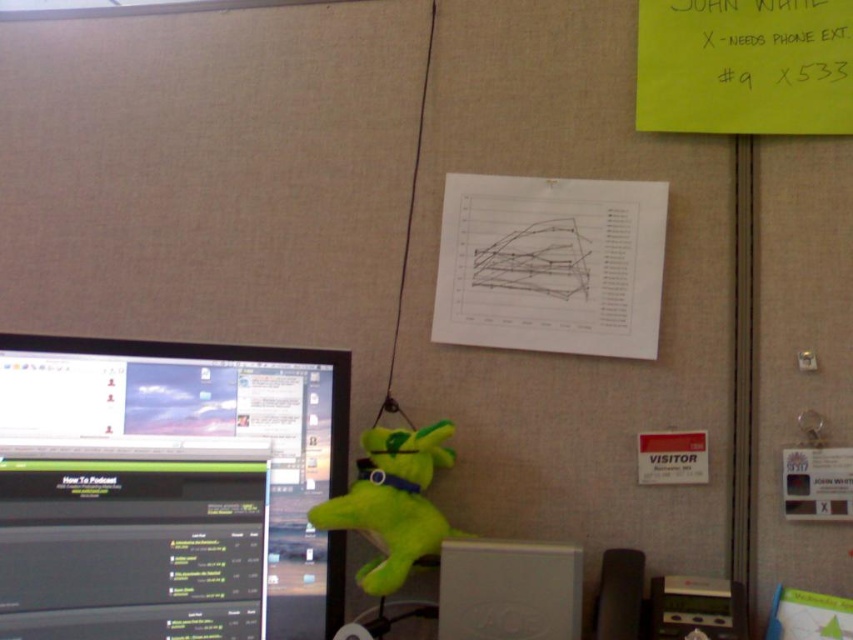
Question: Which object is positioned farthest from the green plush toy at center?

Choices:
 (A) white plastic computer at lower center
 (B) green paper at upper right

Answer: (B)

Question: Which of the following is the farthest from the observer?

Choices:
 (A) white plastic computer at lower center
 (B) green plush toy at center
 (C) green paper at upper right

Answer: (C)

Question: Where is green paper at upper right located in relation to white plastic computer at lower center in the image?

Choices:
 (A) above
 (B) below

Answer: (A)

Question: Is matte black monitor at left below white plastic computer at lower center?

Choices:
 (A) yes
 (B) no

Answer: (B)

Question: Which object is the farthest from the green plush toy at center?

Choices:
 (A) matte black monitor at left
 (B) white plastic computer at lower center

Answer: (A)

Question: Observing the image, what is the correct spatial positioning of matte black monitor at left in reference to white plastic computer at lower center?

Choices:
 (A) right
 (B) left

Answer: (B)